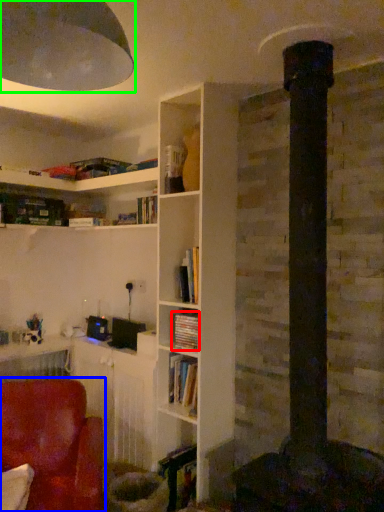
Question: Which is nearer to the book (highlighted by a red box)? chair (highlighted by a blue box) or lamp (highlighted by a green box).

Choices:
 (A) chair
 (B) lamp

Answer: (A)